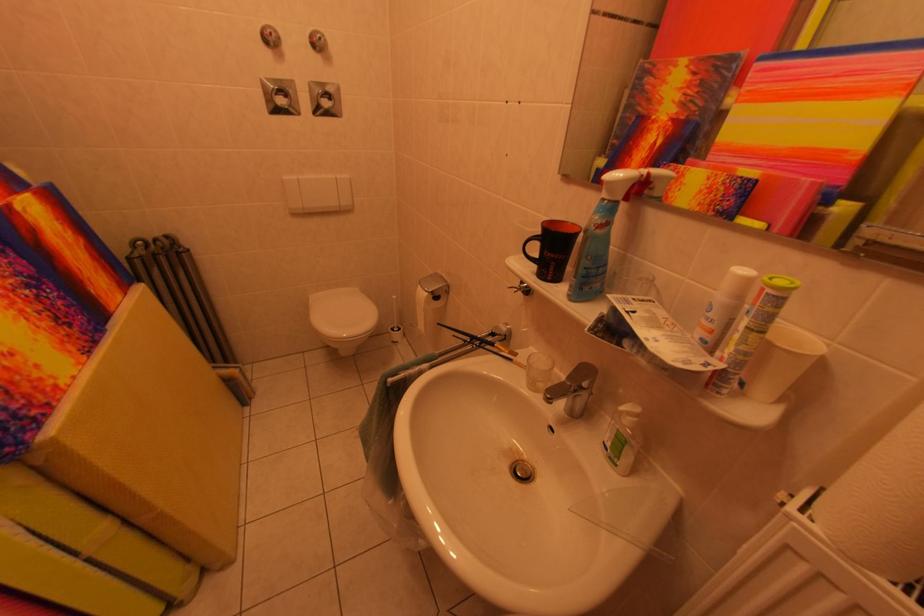
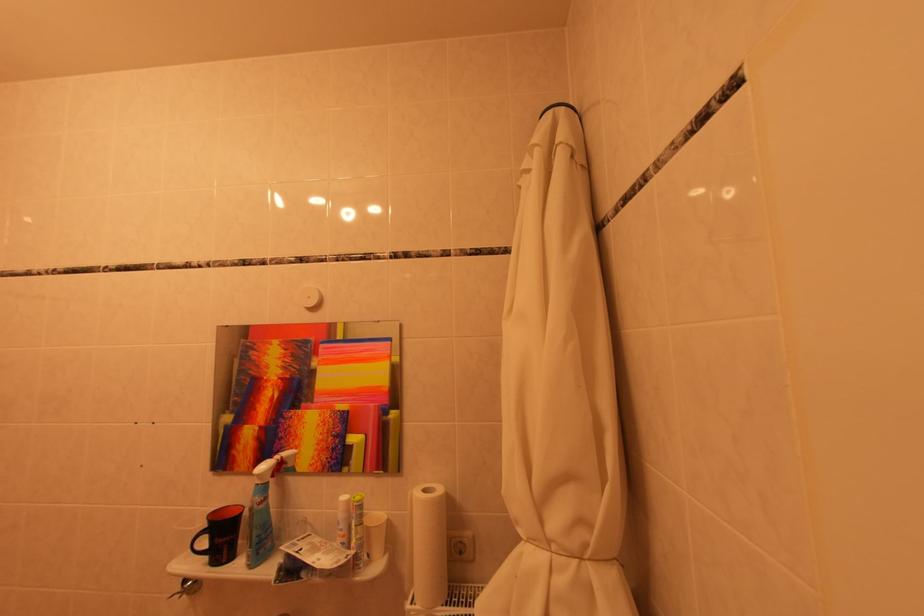
In the second image, find the point that corresponds to point 781,283 in the first image.

(362, 501)